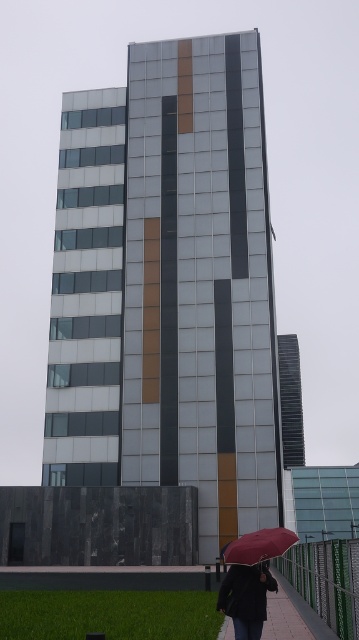
Question: Can you confirm if dark gray fabric jacket at lower center is positioned below matte black umbrella at lower center?

Choices:
 (A) no
 (B) yes

Answer: (A)

Question: Does dark gray fabric jacket at lower center have a greater width compared to matte black umbrella at lower center?

Choices:
 (A) no
 (B) yes

Answer: (A)

Question: Which object appears farthest from the camera in this image?

Choices:
 (A) dark gray fabric jacket at lower center
 (B) matte black umbrella at lower center

Answer: (B)

Question: Which point is closer to the camera?

Choices:
 (A) (274, 554)
 (B) (268, 572)

Answer: (A)

Question: Can you confirm if dark gray fabric jacket at lower center is positioned below matte black umbrella at lower center?

Choices:
 (A) yes
 (B) no

Answer: (B)